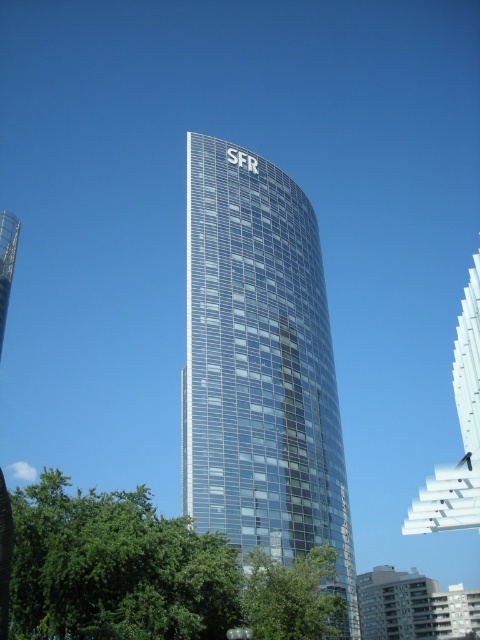
From the picture: You are standing at the base of the transparent glass tower at center and want to see the green leafy tree at lower center. Is the tree visible from your current position?

The transparent glass tower at center is above the green leafy tree at lower center, so the tree might be partially or fully blocked by the tower from your current position at the base.

You are standing at the center of the image. Looking towards the transparent glass tower at center, which direction should you turn to face it?

Since the transparent glass tower at center is located at point coordinates, you are already facing it as you are at the center of the image.